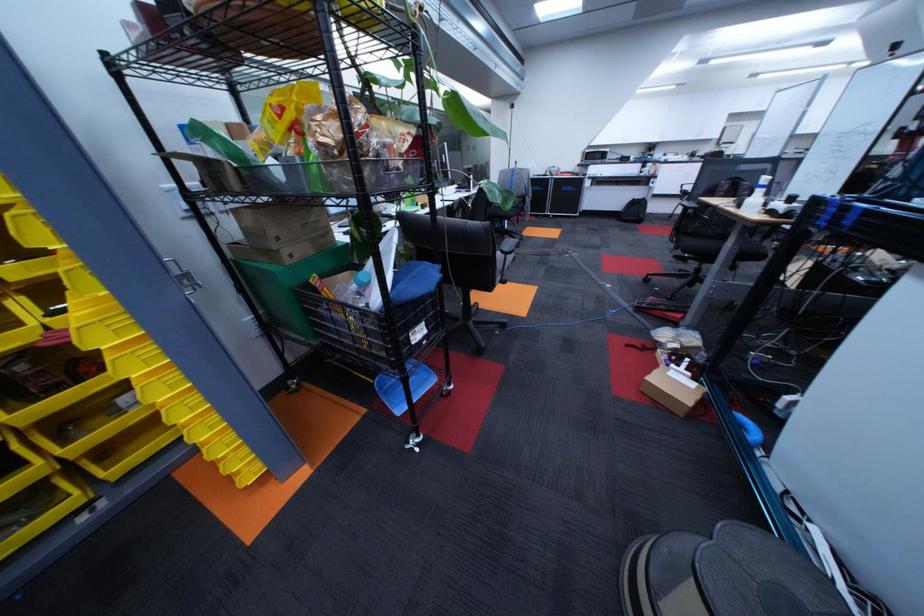
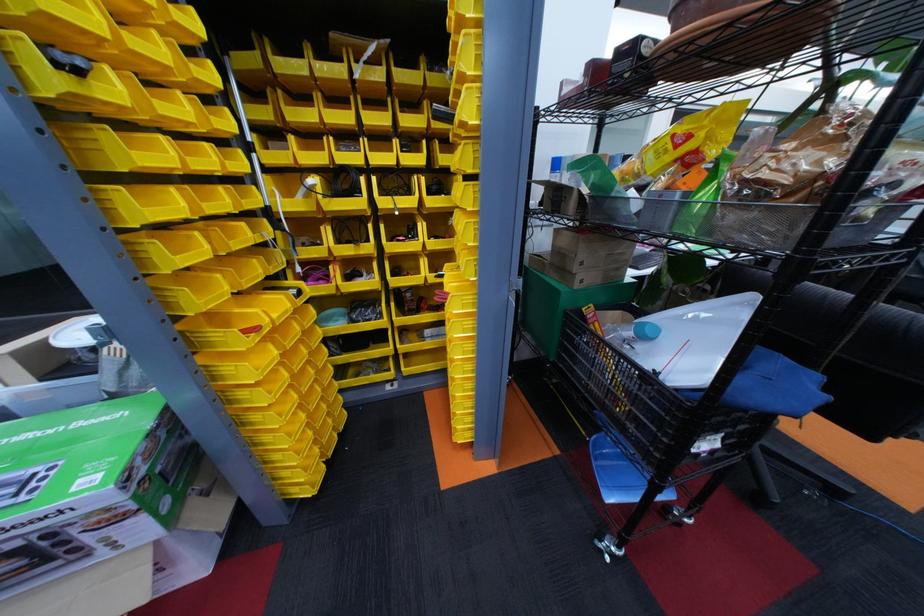
Locate, in the second image, the point that corresponds to pixel 439 333 in the first image.

(732, 446)